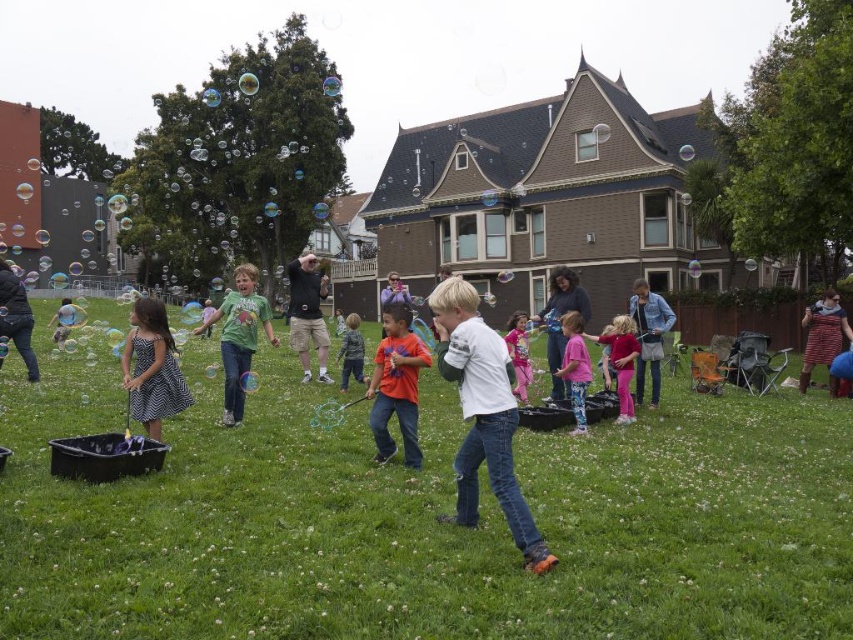
Question: Which of the following is the closest to the observer?

Choices:
 (A) (515, 380)
 (B) (408, 444)
 (C) (160, 381)
 (D) (585, 384)

Answer: (A)

Question: Which point is closer to the camera?

Choices:
 (A) (625, 420)
 (B) (387, 554)
 (C) (577, 381)

Answer: (B)

Question: Can you confirm if polka dot dress at left is positioned to the left of orange cotton shirt at center?

Choices:
 (A) no
 (B) yes

Answer: (B)

Question: Considering the relative positions of green grass at center and pink fabric shirt at center in the image provided, where is green grass at center located with respect to pink fabric shirt at center?

Choices:
 (A) below
 (B) above

Answer: (A)

Question: Can you confirm if pink fabric shirt at center is positioned below orange cotton shirt at center?

Choices:
 (A) no
 (B) yes

Answer: (B)

Question: Which point is farther from the camera taking this photo?

Choices:
 (A) (564, 376)
 (B) (358, 321)
 (C) (624, 323)

Answer: (B)